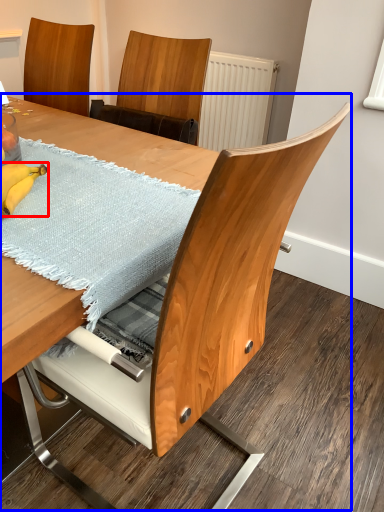
Question: Which object is further to the camera taking this photo, banana (highlighted by a red box) or table (highlighted by a blue box)?

Choices:
 (A) banana
 (B) table

Answer: (A)